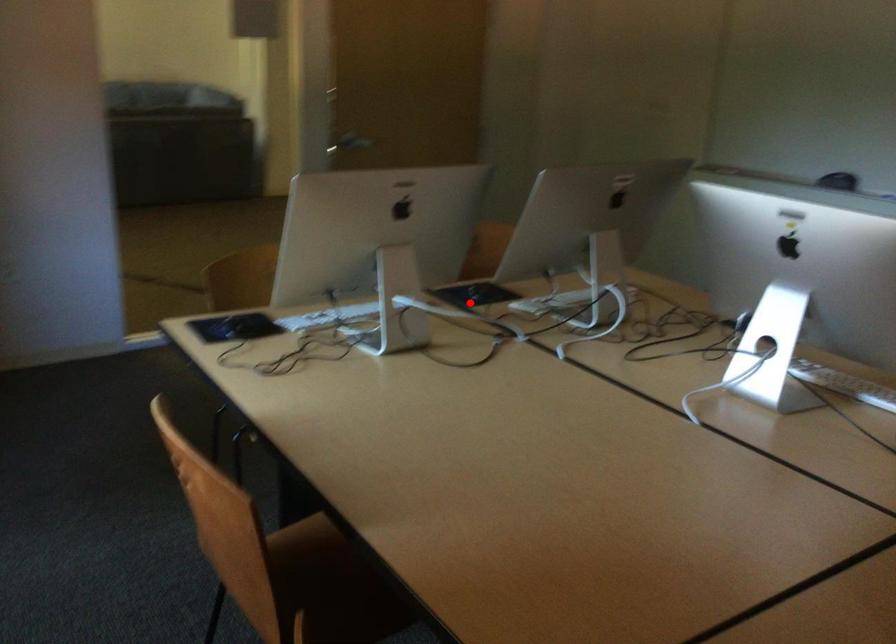
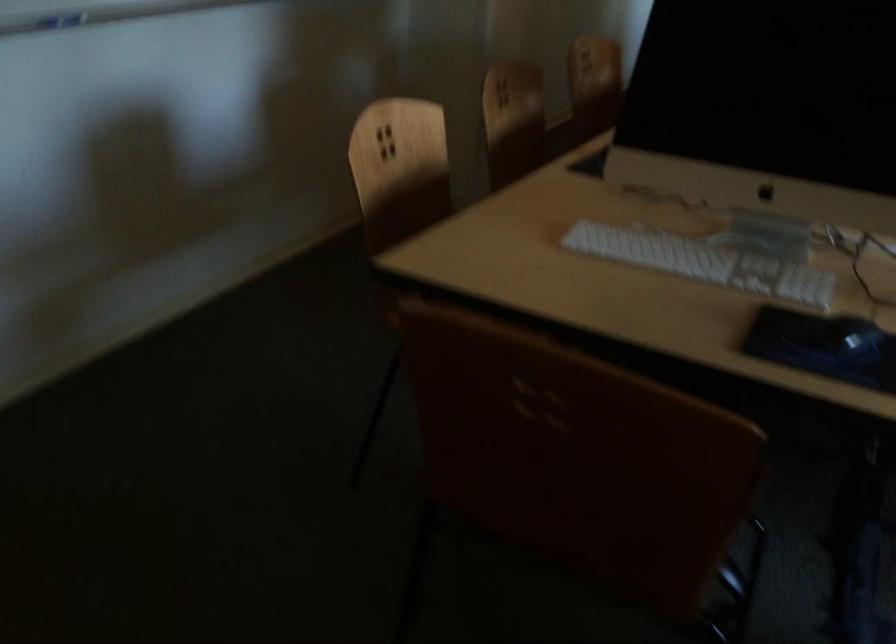
Question: I am providing you with two images of the same scene from different viewpoints. A red point is shown in image1. For the corresponding object point in image2, is it positioned nearer or farther from the camera?

Choices:
 (A) Nearer
 (B) Farther

Answer: (A)